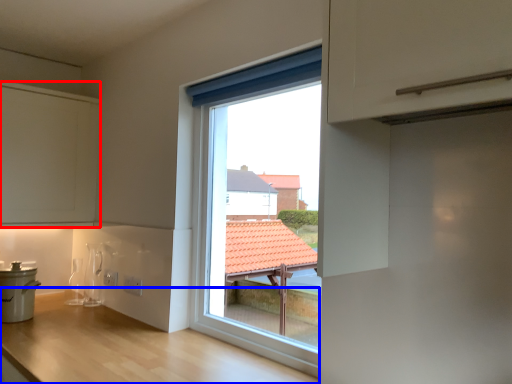
Question: Which object appears farthest to the camera in this image, cabinetry (highlighted by a red box) or counter (highlighted by a blue box)?

Choices:
 (A) cabinetry
 (B) counter

Answer: (A)